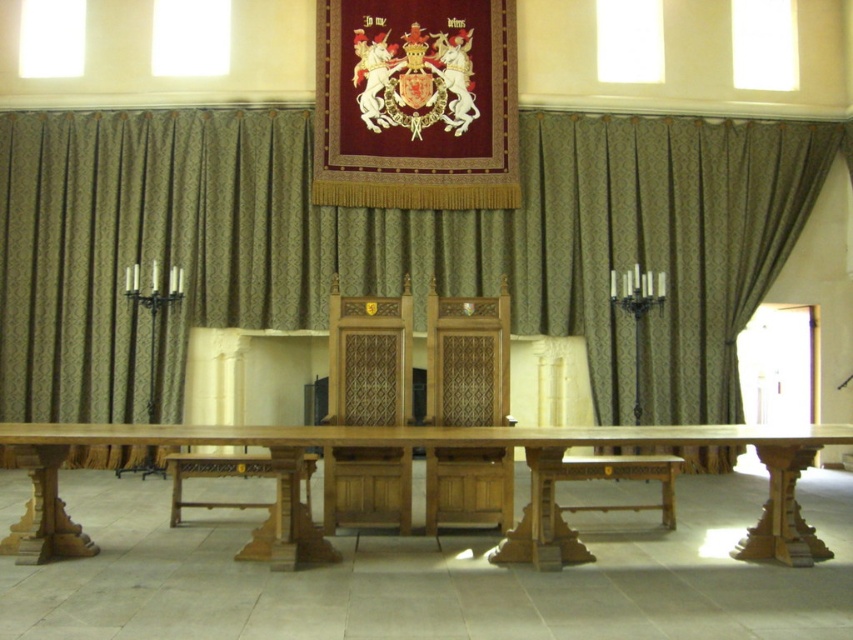
Identify the location of polished wood chair at center. The height and width of the screenshot is (640, 853). (369, 358).

Can you confirm if polished wood chair at center is thinner than wooden chair at center?

No.

Looking at this image, who is more forward, [395,388] or [426,454]?

Point [426,454]

Identify the location of polished wood chair at center. (369, 358).

Which is more to the left, wooden table at center or wooden chair at center?

Positioned to the left is wooden table at center.

Is wooden table at center bigger than wooden chair at center?

Yes.

This screenshot has height=640, width=853. Identify the location of wooden table at center. (403, 445).

Does wooden table at center have a lesser width compared to polished wood chair at center?

Incorrect, wooden table at center's width is not less than polished wood chair at center's.

Is point (300, 560) farther from camera compared to point (352, 518)?

No.

Does point (718, 429) lie in front of point (374, 422)?

Yes, it is in front of point (374, 422).

This screenshot has width=853, height=640. In order to click on wooden table at center in this screenshot , I will do `click(403, 445)`.